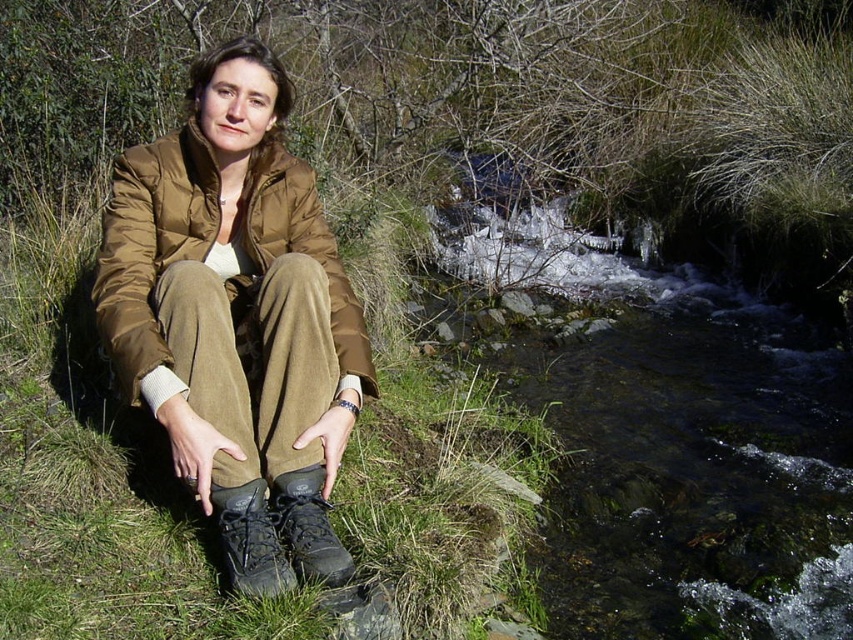
You are a photographer trying to capture the scene with the green soft grass at center and the dark grey leather boot at lower center. Which object should you focus on first if you want to ensure both are in sharp focus?

The green soft grass at center is closer to the viewer than the dark grey leather boot at lower center. To ensure both are in sharp focus, focus on the green soft grass at center first since it is closer, and the depth of field will extend to the boot.

You are standing at the point marked by the coordinates point (96, 477). Looking around, you see the person in brown jacket and pants sitting by the stream. Which direction should you move to reach the stream?

The stream is located to the left of the green soft grass at center represented by point (96, 477). Move towards the left direction from the point to reach the stream.

You are a photographer planning to capture the scene of the person by the stream. You want to ensure the green soft grass at center and the leather boot at lower center are both visible in the frame. Which object should you focus on to ensure both are in the shot without needing to adjust the camera angle?

The green soft grass at center is bigger than the leather boot at lower center, so focusing on the green soft grass at center will ensure both objects are visible in the frame without needing to adjust the camera angle.